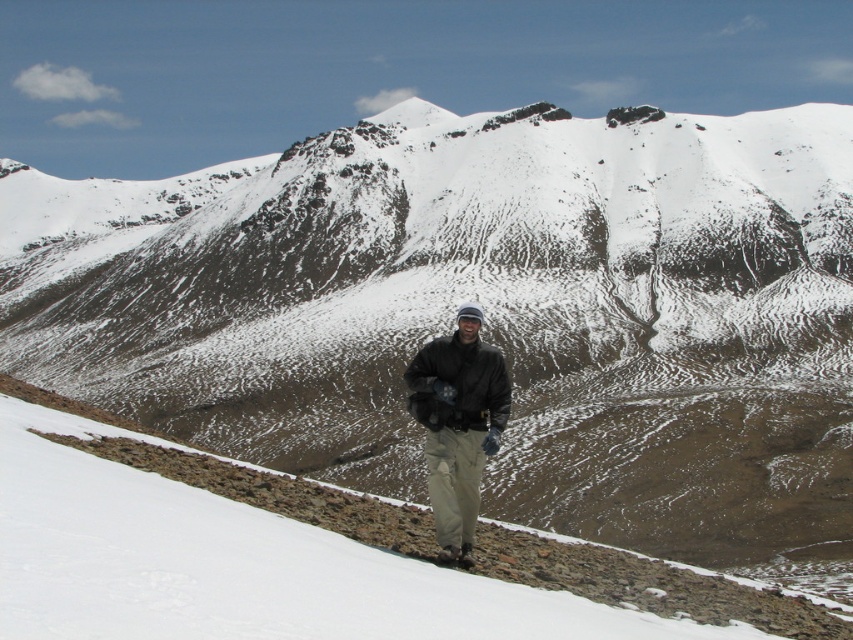
Question: Which point is farther to the camera?

Choices:
 (A) white snow at center
 (B) black matte jacket at center

Answer: (B)

Question: Is white snow at center wider than black matte jacket at center?

Choices:
 (A) yes
 (B) no

Answer: (A)

Question: Observing the image, what is the correct spatial positioning of white snow at center in reference to black matte jacket at center?

Choices:
 (A) above
 (B) below

Answer: (B)

Question: Does white snow at center have a larger size compared to black matte jacket at center?

Choices:
 (A) no
 (B) yes

Answer: (B)

Question: Which point is closer to the camera taking this photo?

Choices:
 (A) (161, 513)
 (B) (447, 344)

Answer: (A)